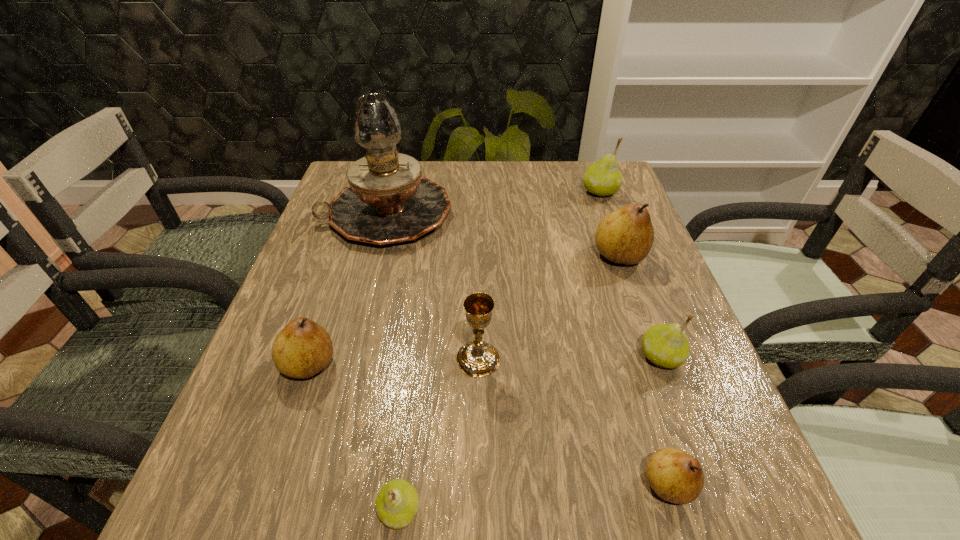
This screenshot has height=540, width=960. What are the coordinates of `vacant space at the right edge of the desktop` in the screenshot? It's located at (585, 224).

This screenshot has height=540, width=960. What are the coordinates of `vacant space at the far right corner of the desktop` in the screenshot? It's located at (588, 205).

At what (x,y) coordinates should I click in order to perform the action: click on free area in between the nearest green pear and the second farthest pear. Please return your answer as a coordinate pair (x, y). Image resolution: width=960 pixels, height=540 pixels. Looking at the image, I should click on (509, 383).

The width and height of the screenshot is (960, 540). I want to click on empty space that is in between the chalice and the smallest green pear, so click(439, 435).

I want to click on vacant point located between the nearest green pear and the biggest brown pear, so click(x=509, y=383).

Locate an element on the screen. Image resolution: width=960 pixels, height=540 pixels. free space between the second biggest green pear and the biggest green pear is located at coordinates (630, 274).

Identify the location of free space between the fifth nearest pear and the nearest brown pear. (644, 370).

Find the location of `free spot between the second farthest green pear and the farthest green pear`. free spot between the second farthest green pear and the farthest green pear is located at coordinates (630, 274).

This screenshot has width=960, height=540. Find the location of `free area in between the second smallest brown pear and the farthest pear`. free area in between the second smallest brown pear and the farthest pear is located at coordinates (454, 278).

Where is `free space between the smallest green pear and the chalice`? Image resolution: width=960 pixels, height=540 pixels. free space between the smallest green pear and the chalice is located at coordinates (439, 435).